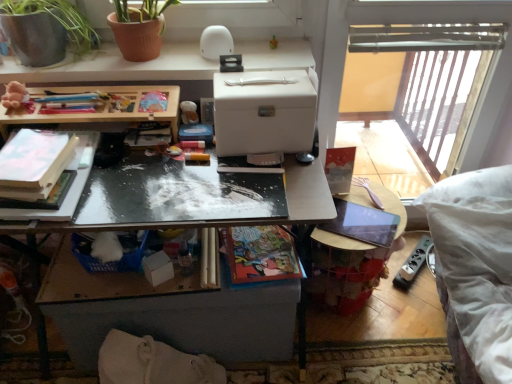
Identify the location of empty space that is ontop of matte paper book at center, which is the 1th book from right to left (from a real-world perspective). This screenshot has height=384, width=512. (260, 248).